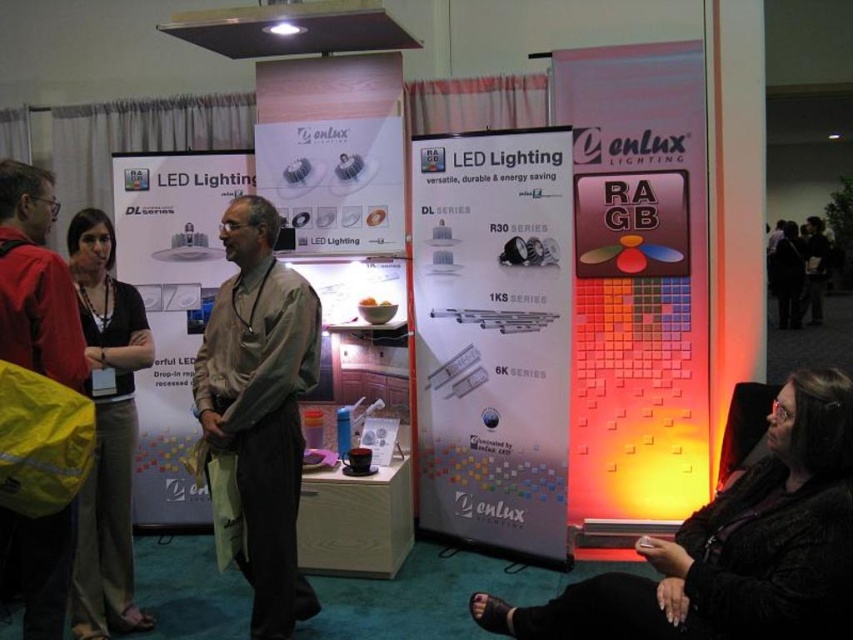
You are a customer at the enLux Lighting trade show booth. You see a white paper poster at center and a light brown fabric shirt at center. Which item is positioned to the right side of the booth?

The white paper poster at center is to the right of the light brown fabric shirt at center, so the white paper poster at center is positioned to the right side of the booth.